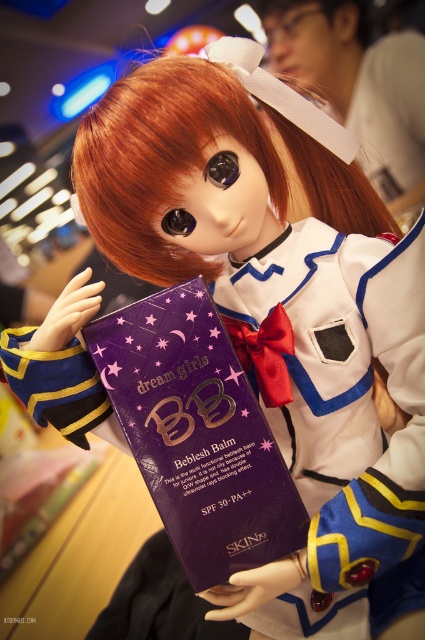
Question: Is purple matte bb cream at center further to camera compared to shiny orange hair at center?

Choices:
 (A) yes
 (B) no

Answer: (A)

Question: Does purple matte bb cream at center have a larger size compared to shiny orange hair at center?

Choices:
 (A) no
 (B) yes

Answer: (A)

Question: Is purple matte bb cream at center positioned behind shiny orange hair at center?

Choices:
 (A) no
 (B) yes

Answer: (B)